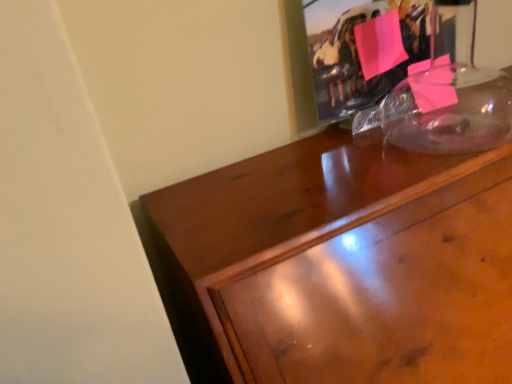
Where is `free point in front of pink paper at upper center`? Image resolution: width=512 pixels, height=384 pixels. free point in front of pink paper at upper center is located at coordinates (398, 158).